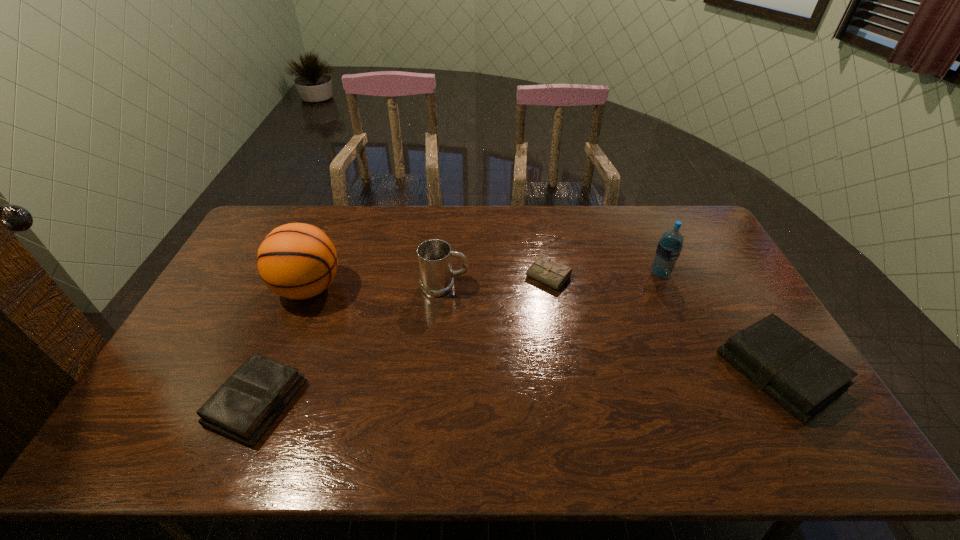
Find the location of a particular element. This screenshot has width=960, height=540. empty location between the second object from right to left and the diary is located at coordinates (604, 275).

Locate an element on the screen. vacant area that lies between the third shortest object and the fourth object from left to right is located at coordinates (664, 325).

This screenshot has width=960, height=540. Identify the location of blank region between the left book and the fifth object from left to right. [458, 338].

Locate an element on the screen. This screenshot has width=960, height=540. object that stands as the fourth closest to the diary is located at coordinates (297, 261).

Select which object is the second closest to the rightmost object. Please provide its 2D coordinates. Your answer should be formatted as a tuple, i.e. [(x, y)], where the tuple contains the x and y coordinates of a point satisfying the conditions above.

[(543, 270)]

At what (x,y) coordinates should I click in order to perform the action: click on free region that satisfies the following two spatial constraints: 1. on the back side of the third shortest object; 2. on the side of the mug with the handle. Please return your answer as a coordinate pair (x, y). The width and height of the screenshot is (960, 540). Looking at the image, I should click on (729, 286).

The image size is (960, 540). Find the location of `vacant area that satisfies the following two spatial constraints: 1. on the back side of the basketball; 2. on the right side of the water bottle`. vacant area that satisfies the following two spatial constraints: 1. on the back side of the basketball; 2. on the right side of the water bottle is located at coordinates (315, 274).

This screenshot has height=540, width=960. I want to click on free space that satisfies the following two spatial constraints: 1. on the side of the rightmost object with the handle; 2. on the right side of the third object from left to right, so click(x=438, y=371).

Where is `blank space that satisfies the following two spatial constraints: 1. on the back side of the shorter book; 2. on the left side of the right book`? The height and width of the screenshot is (540, 960). blank space that satisfies the following two spatial constraints: 1. on the back side of the shorter book; 2. on the left side of the right book is located at coordinates (269, 371).

Where is `vacant space that satisfies the following two spatial constraints: 1. on the back side of the left book; 2. on the left side of the basketball`? The height and width of the screenshot is (540, 960). vacant space that satisfies the following two spatial constraints: 1. on the back side of the left book; 2. on the left side of the basketball is located at coordinates (303, 288).